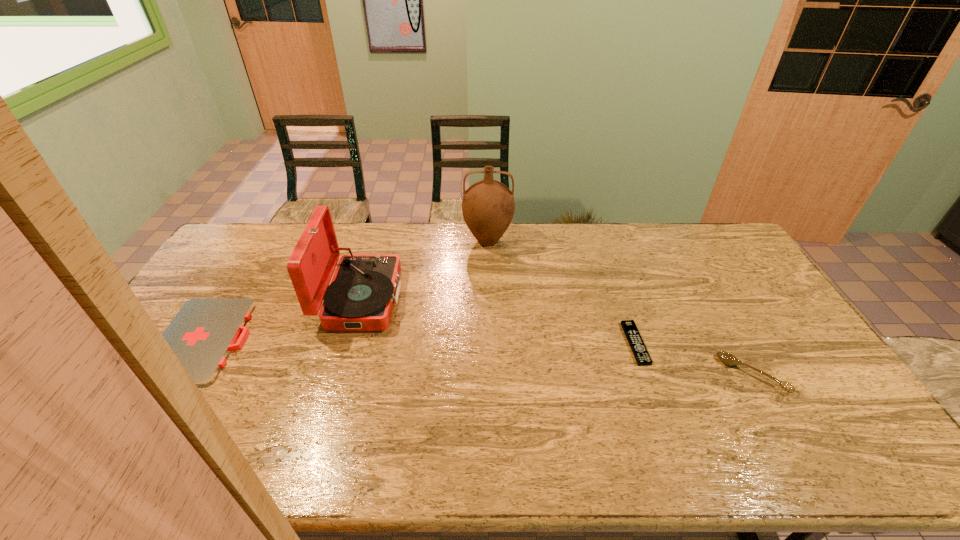
I want to click on empty location between the first-aid kit and the phonograph_record, so click(283, 320).

Locate an element on the screen. This screenshot has height=540, width=960. free space between the fourth object from right to left and the leftmost object is located at coordinates tap(283, 320).

Locate an element on the screen. vacant area between the fourth tallest object and the second object from right to left is located at coordinates (420, 342).

Identify which object is located as the fourth nearest to the first-aid kit. Please provide its 2D coordinates. Your answer should be formatted as a tuple, i.e. [(x, y)], where the tuple contains the x and y coordinates of a point satisfying the conditions above.

[(727, 358)]

Image resolution: width=960 pixels, height=540 pixels. I want to click on object that can be found as the fourth closest to the leftmost object, so click(727, 358).

Find the location of `free point that satisfies the following two spatial constraints: 1. on the back side of the rightmost object; 2. on handle side the first-aid kit`. free point that satisfies the following two spatial constraints: 1. on the back side of the rightmost object; 2. on handle side the first-aid kit is located at coordinates (733, 340).

Identify the location of free location that satisfies the following two spatial constraints: 1. on the back side of the third tallest object; 2. on the front-facing side of the phonograph_record. The width and height of the screenshot is (960, 540). (709, 299).

Find the location of a particular element. vacant space that satisfies the following two spatial constraints: 1. on the front side of the pitcher; 2. on the front-facing side of the second object from left to right is located at coordinates (489, 299).

This screenshot has height=540, width=960. I want to click on free location that satisfies the following two spatial constraints: 1. on the back side of the third tallest object; 2. on the front-facing side of the phonograph_record, so click(709, 299).

Identify the location of free space that satisfies the following two spatial constraints: 1. on the back side of the shortest object; 2. on handle side the first-aid kit. The height and width of the screenshot is (540, 960). (635, 340).